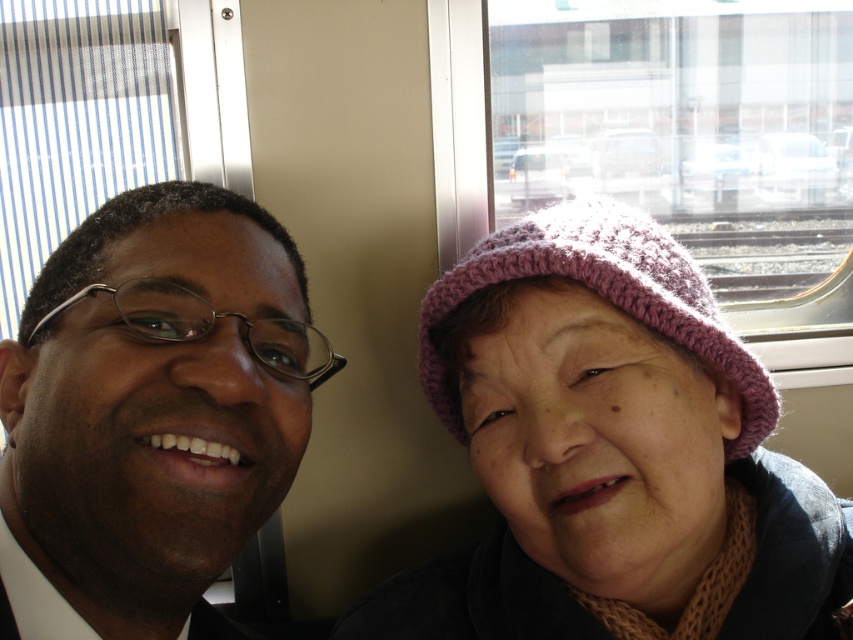
You are a passenger on the train and want to know which of the two points, point (578, 628) or point (173, 582), is closer to you. Based on their positions, which one is nearer?

Point (173, 582) is closer to you because it is less further to the camera than point (578, 628).

You are standing 50 centimeters away from a point marked at coordinates point (x=228, y=422). Can you reach that point with your hand?

The point (x=228, y=422) is 49.21 centimeters away from you, so yes, you can reach it with your hand since it is within arm reach.